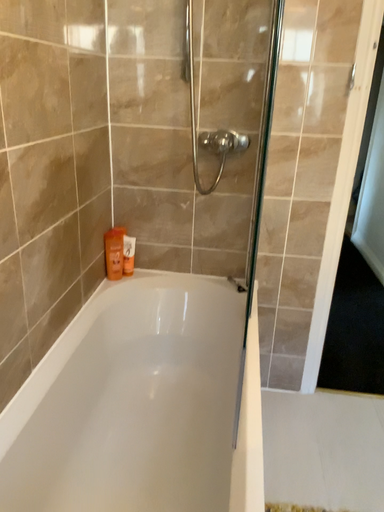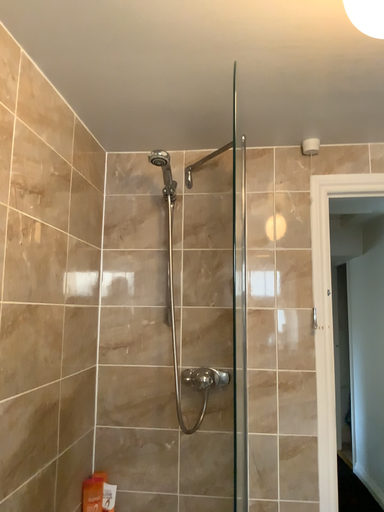
Question: How did the camera likely rotate when shooting the video?

Choices:
 (A) rotated upward
 (B) rotated downward

Answer: (A)